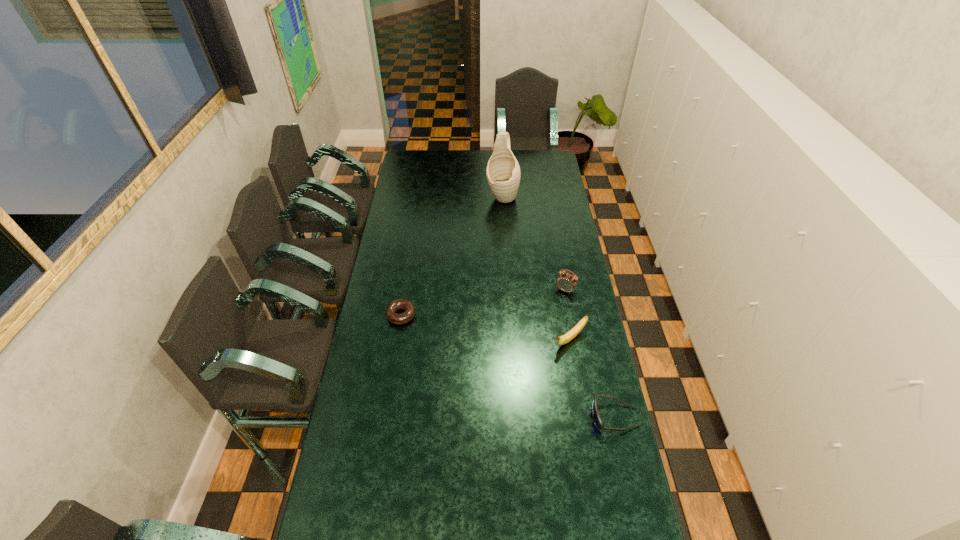
Find the location of a particular element. Image resolution: width=960 pixels, height=540 pixels. free space at the right edge of the desktop is located at coordinates (558, 296).

This screenshot has width=960, height=540. Find the location of `vacant region at the far left corner of the desktop`. vacant region at the far left corner of the desktop is located at coordinates (420, 158).

In the image, there is a desktop. Where is `vacant space at the near left corner`? This screenshot has width=960, height=540. vacant space at the near left corner is located at coordinates (331, 509).

Image resolution: width=960 pixels, height=540 pixels. In the image, there is a desktop. Identify the location of vacant space at the far right corner. (557, 159).

Locate an element on the screen. The image size is (960, 540). vacant area that lies between the third tallest object and the third farthest object is located at coordinates (486, 327).

Where is `vacant area between the pitcher and the leftmost object`? The width and height of the screenshot is (960, 540). vacant area between the pitcher and the leftmost object is located at coordinates (452, 256).

You are a GUI agent. You are given a task and a screenshot of the screen. Output one action in this format:
    pyautogui.click(x=<x>, y=<y>)
    Task: Click on the vacant area between the second nearest object and the third farthest object
    The image size is (960, 540).
    Given the screenshot: What is the action you would take?
    pyautogui.click(x=486, y=327)

What are the coordinates of `free space between the second tallest object and the banana` in the screenshot? It's located at (567, 315).

You are a GUI agent. You are given a task and a screenshot of the screen. Output one action in this format:
    pyautogui.click(x=<x>, y=<y>)
    Task: Click on the empty space that is in between the sunglasses and the second farthest object
    Image resolution: width=960 pixels, height=540 pixels.
    Given the screenshot: What is the action you would take?
    pyautogui.click(x=590, y=354)

Image resolution: width=960 pixels, height=540 pixels. Find the location of `free space between the alarm clock and the fourth farthest object`. free space between the alarm clock and the fourth farthest object is located at coordinates (567, 315).